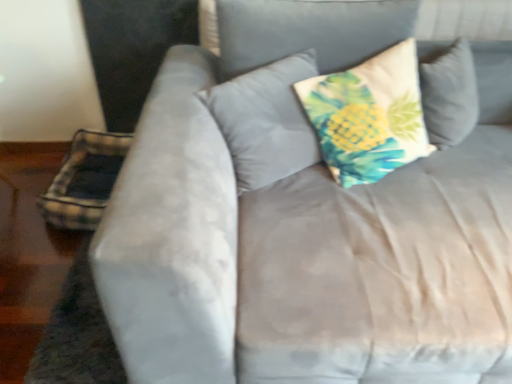
Question: Is the surface of printed fabric pillow at center, which is the 1th pillow from right to left, in direct contact with plaid fabric pillow at lower left, which is counted as the 3th pillow, starting from the right?

Choices:
 (A) yes
 (B) no

Answer: (B)

Question: Is printed fabric pillow at center, which ranks as the third pillow in left-to-right order, shorter than plaid fabric pillow at lower left, the 1th pillow in the left-to-right sequence?

Choices:
 (A) no
 (B) yes

Answer: (A)

Question: Is printed fabric pillow at center, which ranks as the third pillow in left-to-right order, taller than plaid fabric pillow at lower left, the 1th pillow in the left-to-right sequence?

Choices:
 (A) no
 (B) yes

Answer: (B)

Question: From the image's perspective, is printed fabric pillow at center, which is the 1th pillow from right to left, located above plaid fabric pillow at lower left, which is counted as the 3th pillow, starting from the right?

Choices:
 (A) no
 (B) yes

Answer: (B)

Question: Would you consider printed fabric pillow at center, which is the 1th pillow from right to left, to be distant from plaid fabric pillow at lower left, the 1th pillow in the left-to-right sequence?

Choices:
 (A) no
 (B) yes

Answer: (B)

Question: Is printed fabric pillow at center, which ranks as the third pillow in left-to-right order, taller or shorter than plaid fabric pillow at lower left, the 1th pillow in the left-to-right sequence?

Choices:
 (A) tall
 (B) short

Answer: (A)

Question: Which is correct: printed fabric pillow at center, which is the 1th pillow from right to left, is inside plaid fabric pillow at lower left, the 1th pillow in the left-to-right sequence, or outside of it?

Choices:
 (A) outside
 (B) inside

Answer: (A)

Question: From a real-world perspective, is printed fabric pillow at center, which ranks as the third pillow in left-to-right order, physically located above or below plaid fabric pillow at lower left, which is counted as the 3th pillow, starting from the right?

Choices:
 (A) above
 (B) below

Answer: (A)

Question: Does point (332, 173) appear closer or farther from the camera than point (74, 173)?

Choices:
 (A) farther
 (B) closer

Answer: (B)

Question: Is printed fabric pillow at center, the 2th pillow from the left, in front of or behind plaid fabric pillow at lower left, the 1th pillow in the left-to-right sequence, in the image?

Choices:
 (A) front
 (B) behind

Answer: (A)

Question: From a real-world perspective, is printed fabric pillow at center, the second pillow from the right, physically located above or below plaid fabric pillow at lower left, the 1th pillow in the left-to-right sequence?

Choices:
 (A) above
 (B) below

Answer: (A)

Question: From the image's perspective, is printed fabric pillow at center, the second pillow from the right, above or below plaid fabric pillow at lower left, the 1th pillow in the left-to-right sequence?

Choices:
 (A) above
 (B) below

Answer: (A)

Question: Is printed fabric pillow at center, the second pillow from the right, taller or shorter than plaid fabric pillow at lower left, the 1th pillow in the left-to-right sequence?

Choices:
 (A) tall
 (B) short

Answer: (A)

Question: Choose the correct answer: Is plaid fabric pillow at lower left, which is counted as the 3th pillow, starting from the right, inside printed fabric pillow at center, which is the 1th pillow from right to left, or outside it?

Choices:
 (A) outside
 (B) inside

Answer: (A)

Question: Is plaid fabric pillow at lower left, the 1th pillow in the left-to-right sequence, in front of or behind printed fabric pillow at center, which ranks as the third pillow in left-to-right order, in the image?

Choices:
 (A) front
 (B) behind

Answer: (B)